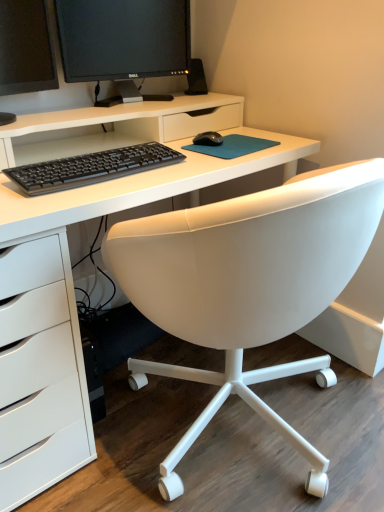
Question: In which direction should I rotate to look at black glossy monitor at upper center, which is the 1th computer monitor from right to left?

Choices:
 (A) left
 (B) right

Answer: (A)

Question: Does black glossy monitor at upper left, placed as the first computer monitor when sorted from left to right, have a greater width compared to white matte desk at center?

Choices:
 (A) no
 (B) yes

Answer: (A)

Question: From the image's perspective, is black glossy monitor at upper left, arranged as the second computer monitor when viewed from the right, over white matte desk at center?

Choices:
 (A) no
 (B) yes

Answer: (B)

Question: Is black glossy monitor at upper left, arranged as the second computer monitor when viewed from the right, oriented towards white matte desk at center?

Choices:
 (A) yes
 (B) no

Answer: (B)

Question: Can we say black glossy monitor at upper left, placed as the first computer monitor when sorted from left to right, lies outside white matte desk at center?

Choices:
 (A) no
 (B) yes

Answer: (B)

Question: Is the depth of black glossy monitor at upper left, arranged as the second computer monitor when viewed from the right, greater than that of white matte desk at center?

Choices:
 (A) yes
 (B) no

Answer: (A)

Question: From a real-world perspective, is black glossy monitor at upper left, arranged as the second computer monitor when viewed from the right, positioned under white matte desk at center based on gravity?

Choices:
 (A) no
 (B) yes

Answer: (A)

Question: Can you confirm if black matte keyboard at center is positioned to the left of black matte mouse at center?

Choices:
 (A) no
 (B) yes

Answer: (B)

Question: From the image's perspective, is black matte keyboard at center above black matte mouse at center?

Choices:
 (A) yes
 (B) no

Answer: (B)

Question: Can black matte mouse at center be found inside black matte keyboard at center?

Choices:
 (A) yes
 (B) no

Answer: (B)

Question: Is black matte keyboard at center shorter than black matte mouse at center?

Choices:
 (A) no
 (B) yes

Answer: (A)

Question: From a real-world perspective, is black matte keyboard at center under black matte mouse at center?

Choices:
 (A) no
 (B) yes

Answer: (B)

Question: Is black matte keyboard at center located outside black matte mouse at center?

Choices:
 (A) no
 (B) yes

Answer: (B)

Question: From a real-world perspective, is black plastic speaker at upper center on black glossy monitor at upper left, placed as the first computer monitor when sorted from left to right?

Choices:
 (A) yes
 (B) no

Answer: (B)